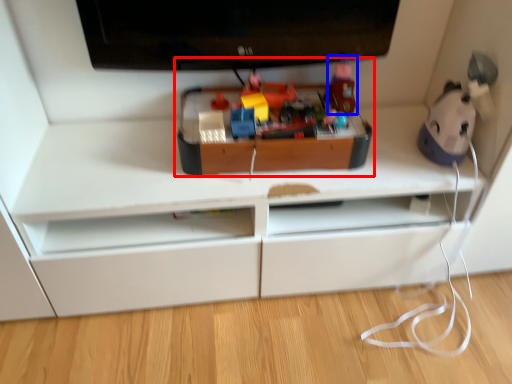
Question: Which object appears closest to the camera in this image, toy (highlighted by a red box) or toy (highlighted by a blue box)?

Choices:
 (A) toy
 (B) toy

Answer: (A)